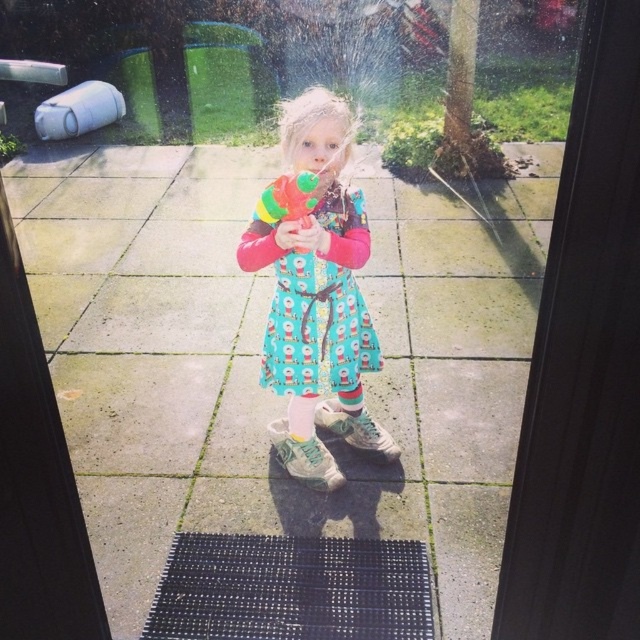
In the scene shown: You are a parent looking through a window at your child playing outside. You notice the child is wearing two dresses. Which dress is visible closer to you, the turquoise fabric dress at center or the cotton dress at center?

The turquoise fabric dress at center is visible closer to you because it is in front of the cotton dress at center.

You are trying to locate the exact spot where the child is standing on the patio. According to the coordinates provided, where is the turquoise fabric dress at center positioned?

The turquoise fabric dress at center is positioned at point (317, 298).